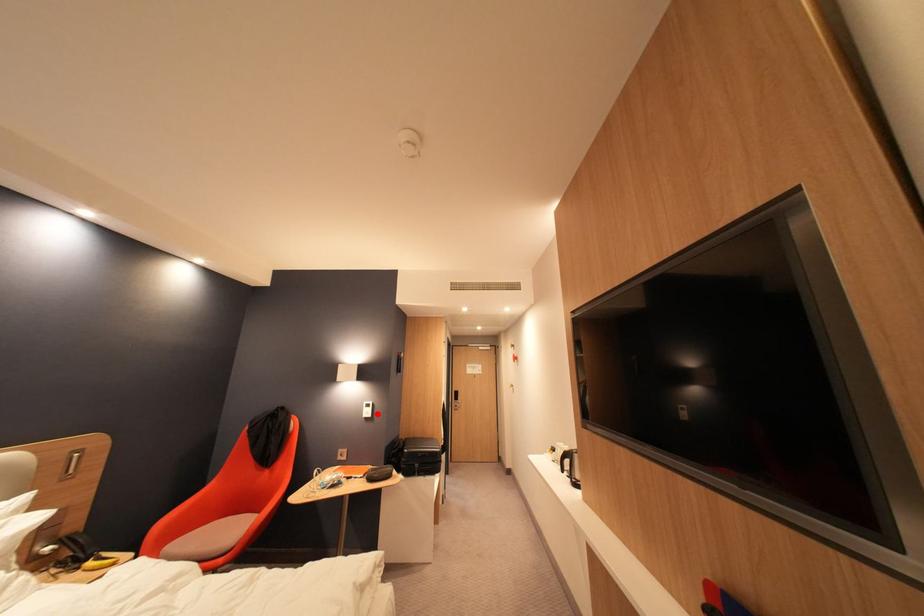
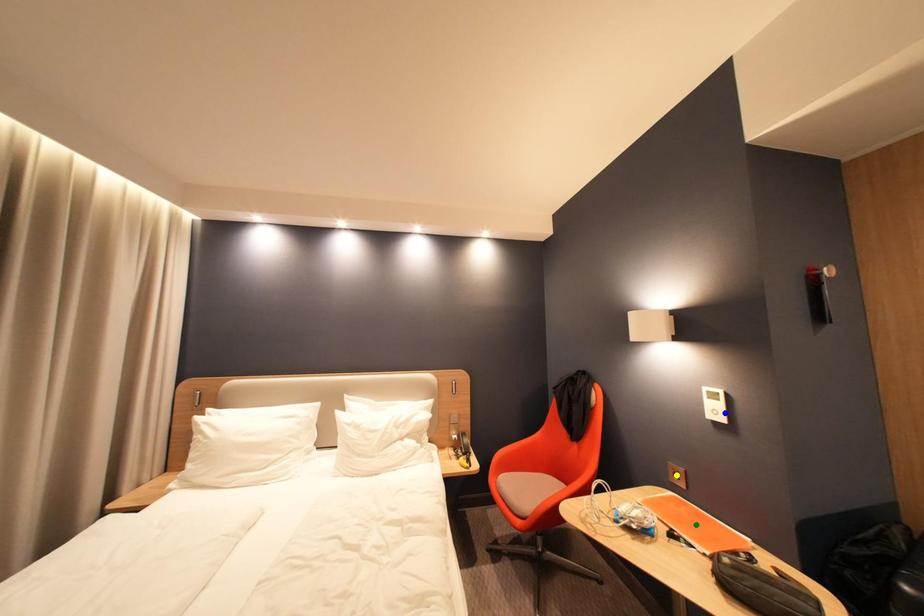
Question: I am providing you with two images of the same scene from different viewpoints. A red point is marked on the first image. You are given multiple points on the second image. Which point in image 2 is actually the same real-world point as the red point in image 1?

Choices:
 (A) yellow point
 (B) blue point
 (C) green point

Answer: (B)